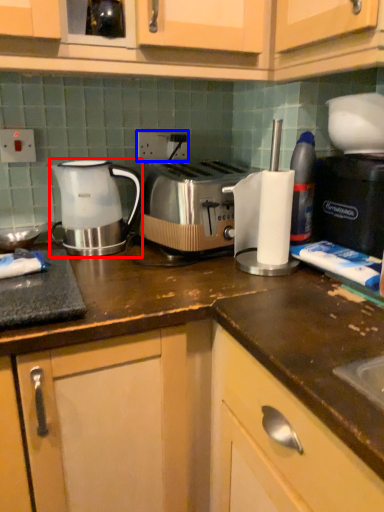
Question: Which of the following is the farthest to the observer, kettle (highlighted by a red box) or electric outlet (highlighted by a blue box)?

Choices:
 (A) kettle
 (B) electric outlet

Answer: (B)